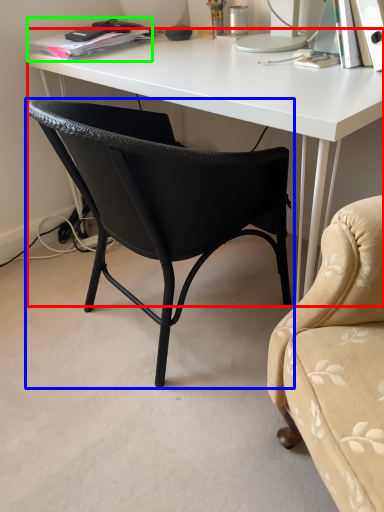
Question: Estimate the real-world distances between objects in this image. Which object is closer to desk (highlighted by a red box), chair (highlighted by a blue box) or book (highlighted by a green box)?

Choices:
 (A) chair
 (B) book

Answer: (A)